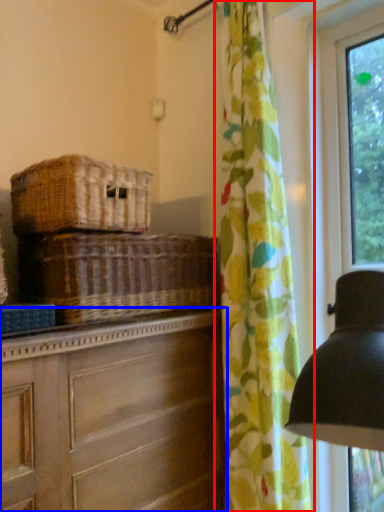
Question: Which of the following is the closest to the observer, curtain (highlighted by a red box) or chest of drawers (highlighted by a blue box)?

Choices:
 (A) curtain
 (B) chest of drawers

Answer: (B)